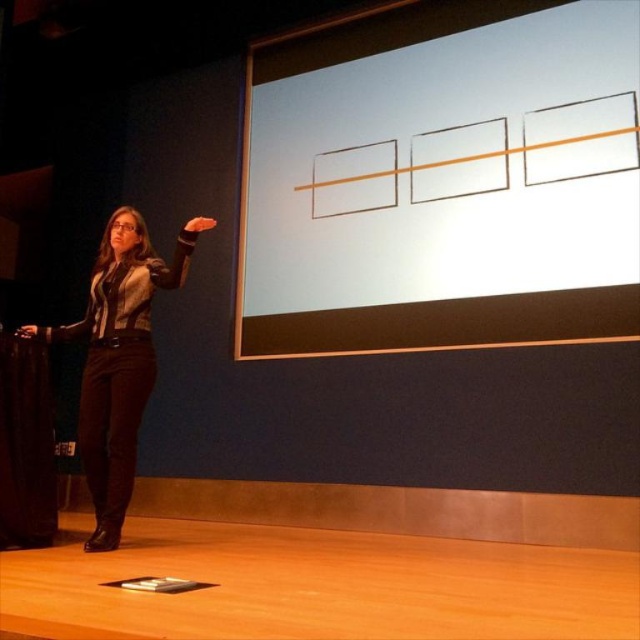
You are an audience member sitting in the front row of the stage. You notice the white matte projection screen at upper center and the black leather pants at lower left. Which object is positioned higher in the image?

The white matte projection screen at upper center is positioned higher than the black leather pants at lower left.

You are sitting in the audience and want to focus on the white matte projection screen at upper center. Based on the speaker standing on stage, can you estimate whether the screen is positioned to the left, right, or directly in front of the speaker?

The white matte projection screen at upper center is located at point coordinates that place it directly in front of the speaker since it is at the upper center position relative to the stage setup described.

You are an event planner setting up a presentation. You need to ensure that the white matte projection screen at upper center and the black leather pants at lower left are visible to the audience. Which object is wider so that it can be seen more easily from the sides of the room?

The white matte projection screen at upper center is wider than the black leather pants at lower left, so it will be more visible from the sides of the room.